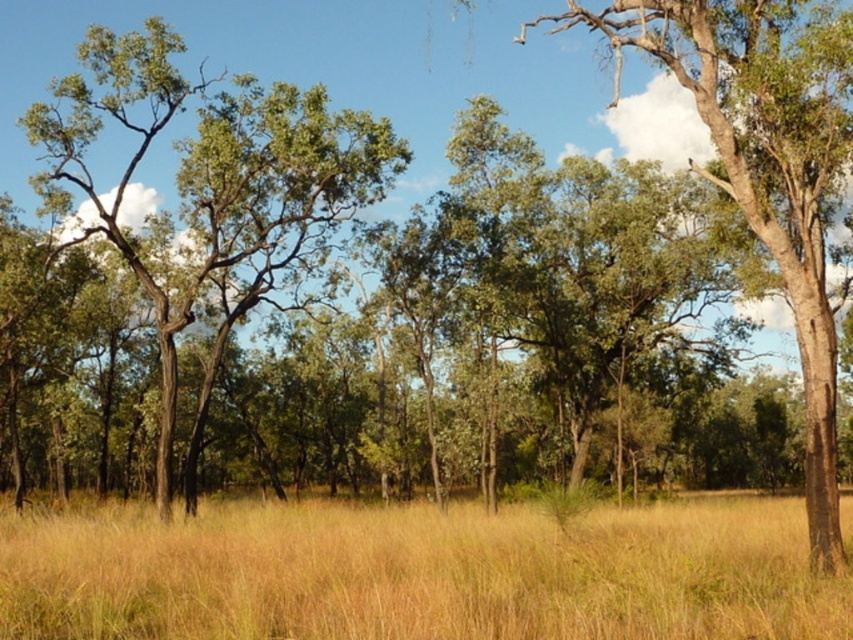
Question: Which point appears closest to the camera in this image?

Choices:
 (A) (437, 516)
 (B) (181, 180)

Answer: (A)

Question: Which object is positioned farthest from the green leafy tree at center?

Choices:
 (A) green leafy tree at left
 (B) yellow grass at center

Answer: (A)

Question: From the image, what is the correct spatial relationship of yellow grass at center in relation to green leafy tree at left?

Choices:
 (A) above
 (B) below

Answer: (B)

Question: Considering the real-world distances, which object is closest to the yellow grass at center?

Choices:
 (A) green leafy tree at left
 (B) green leafy tree at center

Answer: (B)

Question: Observing the image, what is the correct spatial positioning of yellow grass at center in reference to green leafy tree at left?

Choices:
 (A) left
 (B) right

Answer: (B)

Question: In this image, where is yellow grass at center located relative to green leafy tree at center?

Choices:
 (A) below
 (B) above

Answer: (A)